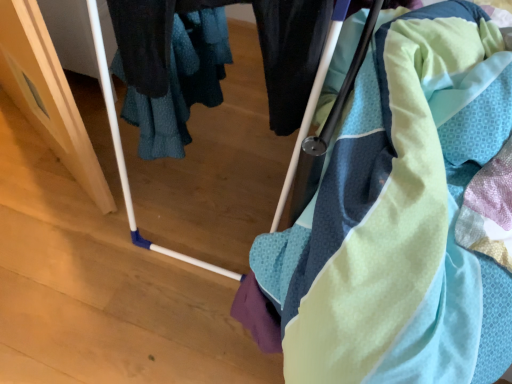
Question: Should I look upward or downward to see matte plastic baby carriage at center?

Choices:
 (A) down
 (B) up

Answer: (B)

Question: Can you confirm if textured cotton towel at center is shorter than matte plastic baby carriage at center?

Choices:
 (A) no
 (B) yes

Answer: (B)

Question: Would you consider textured cotton towel at center to be distant from matte plastic baby carriage at center?

Choices:
 (A) yes
 (B) no

Answer: (B)

Question: From a real-world perspective, is textured cotton towel at center beneath matte plastic baby carriage at center?

Choices:
 (A) no
 (B) yes

Answer: (B)

Question: Is textured cotton towel at center not inside matte plastic baby carriage at center?

Choices:
 (A) yes
 (B) no

Answer: (A)

Question: Does textured cotton towel at center turn towards matte plastic baby carriage at center?

Choices:
 (A) yes
 (B) no

Answer: (A)

Question: From the image's perspective, is textured cotton towel at center below matte plastic baby carriage at center?

Choices:
 (A) no
 (B) yes

Answer: (B)

Question: Is matte plastic baby carriage at center in front of textured cotton towel at center?

Choices:
 (A) no
 (B) yes

Answer: (B)

Question: Considering the relative positions of matte plastic baby carriage at center and textured cotton towel at center in the image provided, is matte plastic baby carriage at center to the right of textured cotton towel at center from the viewer's perspective?

Choices:
 (A) yes
 (B) no

Answer: (A)

Question: Does matte plastic baby carriage at center have a lesser width compared to textured cotton towel at center?

Choices:
 (A) no
 (B) yes

Answer: (B)

Question: Can you confirm if matte plastic baby carriage at center is bigger than textured cotton towel at center?

Choices:
 (A) no
 (B) yes

Answer: (B)

Question: Is matte plastic baby carriage at center oriented towards textured cotton towel at center?

Choices:
 (A) yes
 (B) no

Answer: (B)

Question: Is matte plastic baby carriage at center facing away from textured cotton towel at center?

Choices:
 (A) yes
 (B) no

Answer: (B)

Question: Is textured cotton towel at center taller or shorter than matte plastic baby carriage at center?

Choices:
 (A) tall
 (B) short

Answer: (B)